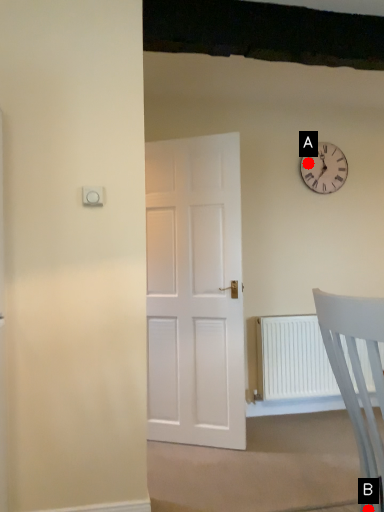
Question: Two points are circled on the image, labeled by A and B beside each circle. Which point is closer to the camera?

Choices:
 (A) A is closer
 (B) B is closer

Answer: (B)